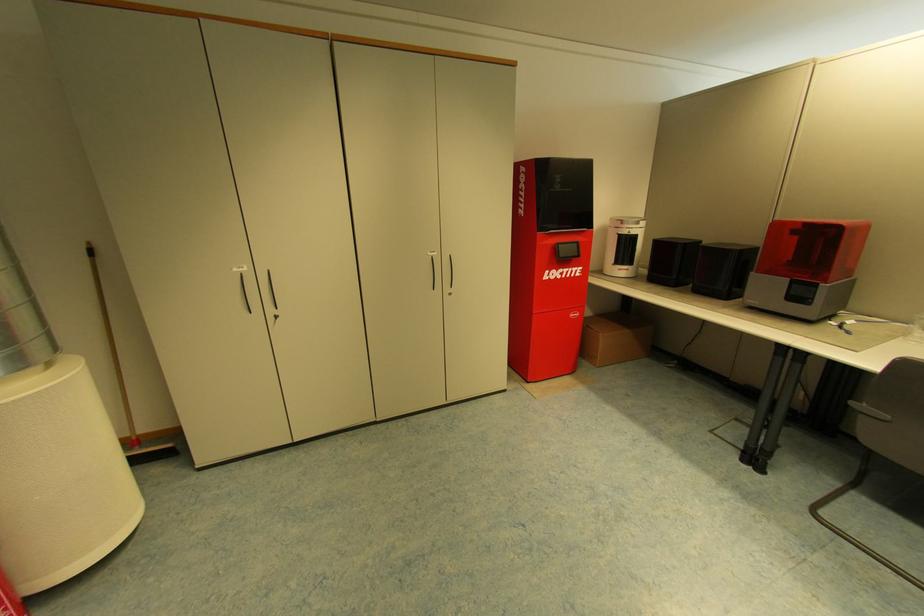
Where is `small metal scraper`? Image resolution: width=924 pixels, height=616 pixels. small metal scraper is located at coordinates (623, 246).